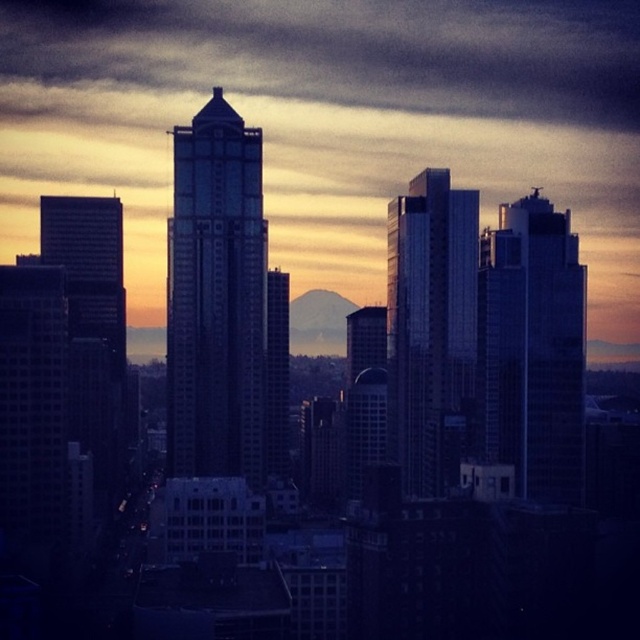
You are an architect analyzing the cityscape. You observe the glassy reflective skyscraper at center and the glossy glass skyscraper at center. Which of these two skyscrapers is bigger in size?

The glassy reflective skyscraper at center is larger in size compared to the glossy glass skyscraper at center according to the description.

You are a drone operator tasked with flying a drone between the glassy reflective skyscraper at center and the sleek glass skyscraper at right. The drone requires a minimum of 120 meters of clearance between the two buildings to navigate safely. Based on the scene description, can the drone safely pass between them?

The glassy reflective skyscraper at center is 135.02 meters from the sleek glass skyscraper at right. Since the required clearance is 120 meters, the drone can safely pass between them as the distance exceeds the minimum requirement.

You are standing in the city and looking at the point specified at coordinates point (216, 298). What object is located at that point?

The point (216, 298) indicates the glassy reflective skyscraper at center.